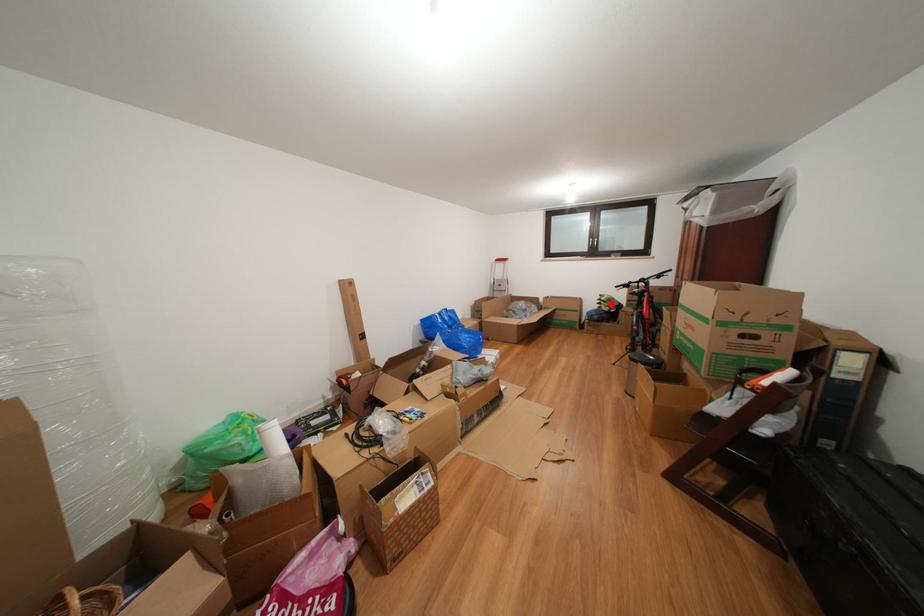
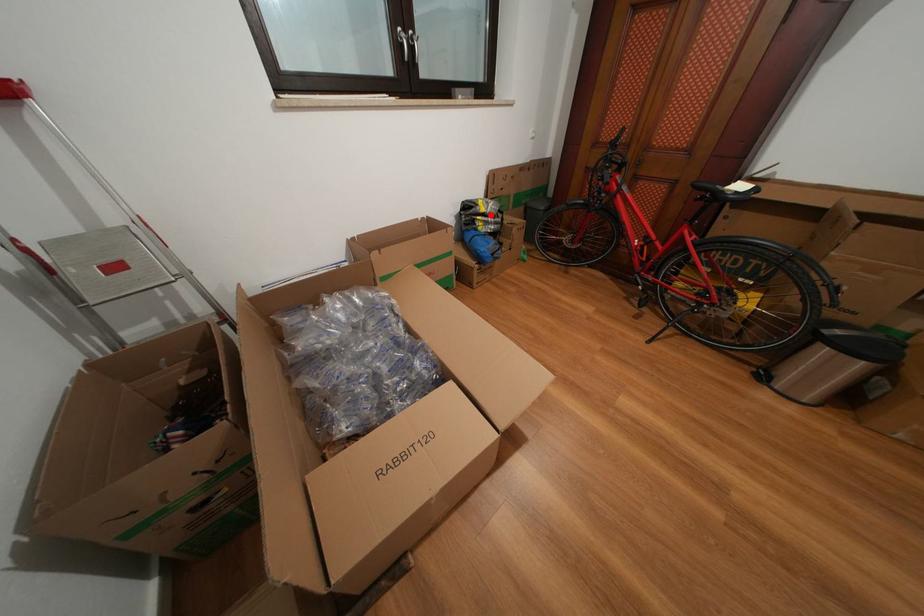
I am providing you with two images of the same scene from different viewpoints. A red point is marked on the first image and another point is marked on the second image. Is the marked point in image1 the same physical position as the marked point in image2?

Yes